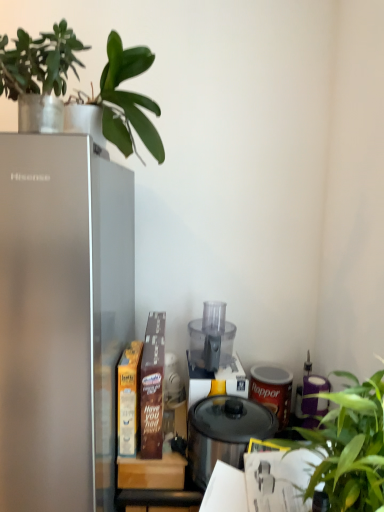
Question: From a real-world perspective, is satin silver refrigerator at left positioned above or below transparent plastic blender at center?

Choices:
 (A) above
 (B) below

Answer: (B)

Question: Would you say satin silver refrigerator at left is inside or outside transparent plastic blender at center?

Choices:
 (A) outside
 (B) inside

Answer: (A)

Question: Which is farther from the satin silver refrigerator at left?

Choices:
 (A) green leafy plant at right, the first houseplant when ordered from bottom to top
 (B) green matte plant at upper left, which is the second houseplant in right-to-left order
 (C) transparent plastic blender at center
 (D) black glossy pressure cooker at center

Answer: (C)

Question: Which object is positioned farthest from the satin silver refrigerator at left?

Choices:
 (A) transparent plastic blender at center
 (B) green matte plant at upper left, which ranks as the first houseplant in left-to-right order
 (C) green leafy plant at right, acting as the second houseplant starting from the top
 (D) black glossy pressure cooker at center

Answer: (A)